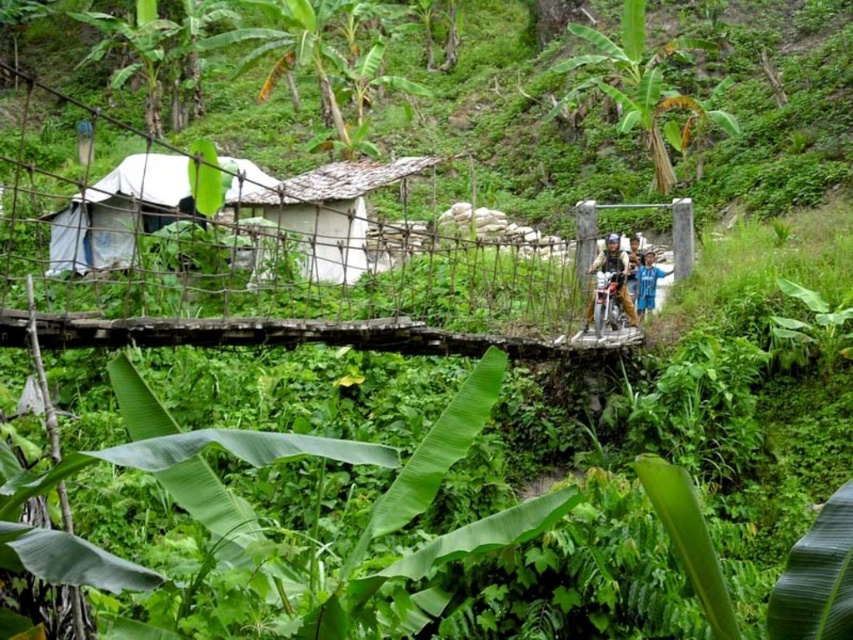
Looking at this image, you are planning to set up a small campsite and need to choose between the green leafy hillside at upper center and the white fabric tent at left. Based on their positions, which location is closer to you for easier access?

The white fabric tent at left is closer to you than the green leafy hillside at upper center, so it would be easier to access.

You are standing at the point labeled as point (x=773, y=104). Looking around, what do you see in the immediate vicinity?

At point (x=773, y=104), you see green leafy hillside at upper center.